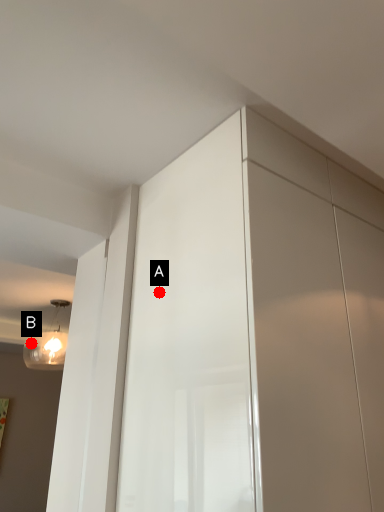
Question: Two points are circled on the image, labeled by A and B beside each circle. Which point is further to the camera?

Choices:
 (A) A is further
 (B) B is further

Answer: (B)